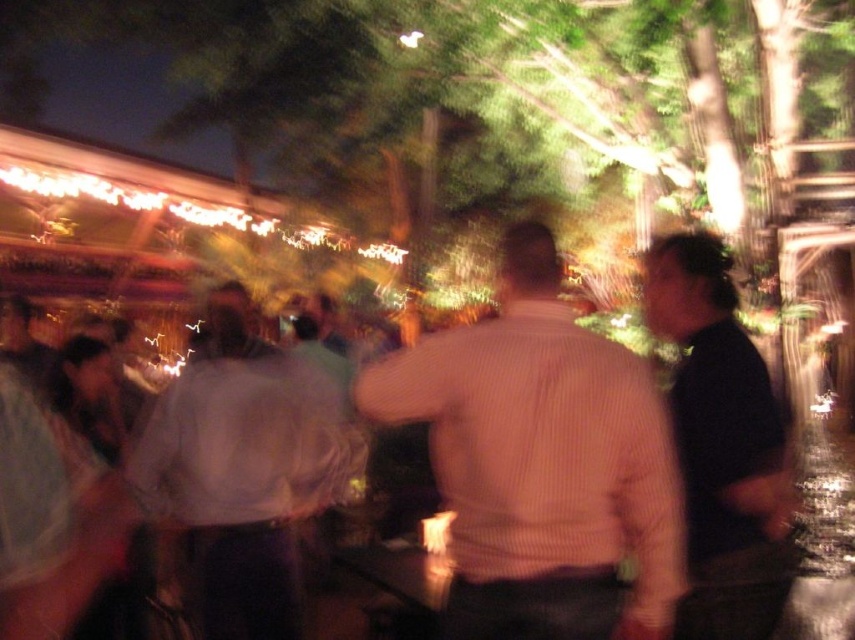
You are at a social gathering and want to greet the person wearing the black matte shirt at right. Since the white cotton shirt at center is in your way, can you walk around them to reach the person?

The black matte shirt at right is behind the white cotton shirt at center, so you can walk around the white cotton shirt at center to reach the person wearing the black matte shirt at right.

You are planning to place a large centerpiece on the light brown wood table at center. Considering the size of the black matte shirt at right, will there be enough space on the table?

The light brown wood table at center is bigger than the black matte shirt at right, so there should be enough space to place the large centerpiece on the table.